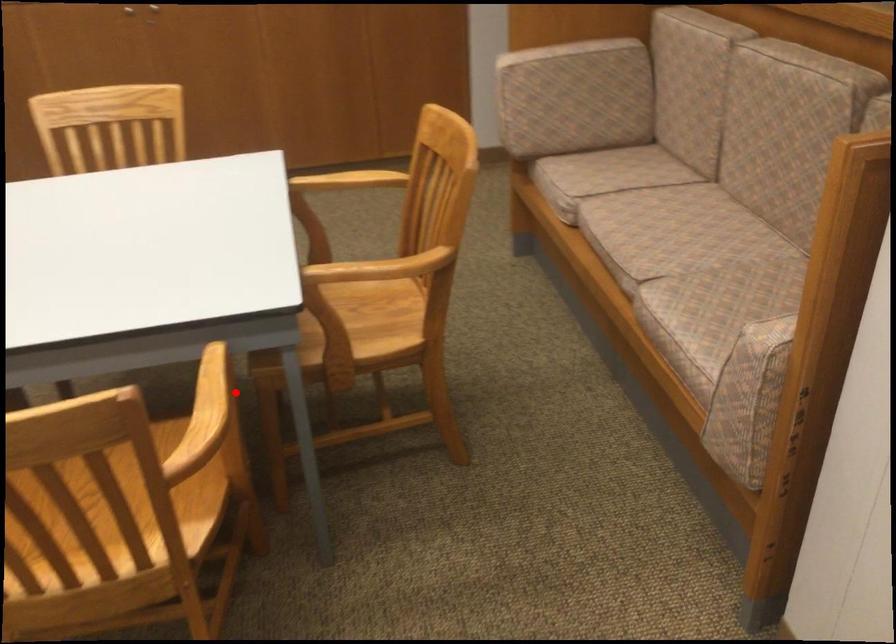
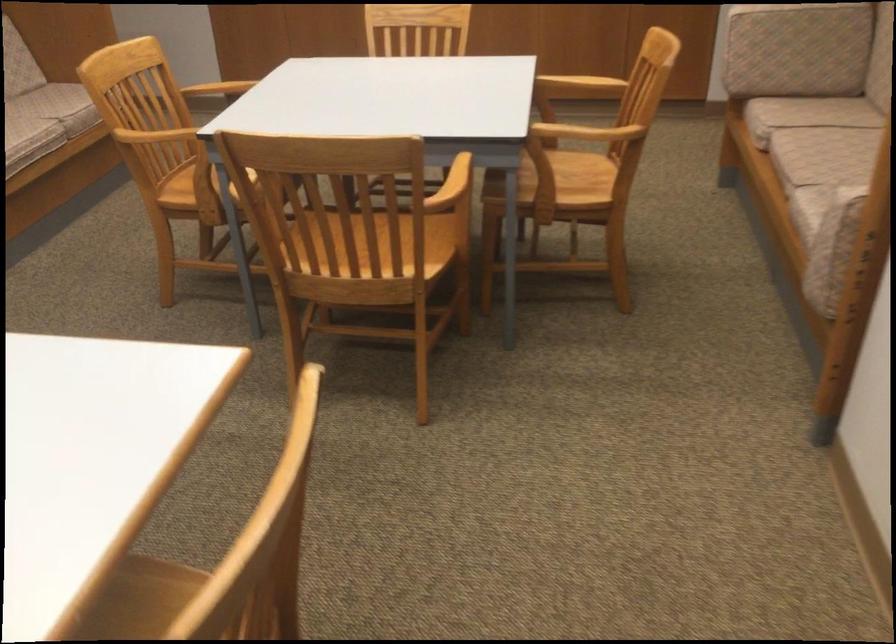
Find the pixel in the second image that matches the highlighted location in the first image.

(470, 174)